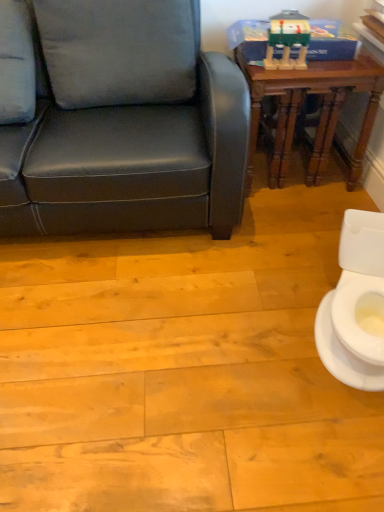
Question: Considering their positions, is white glossy toilet at lower right located in front of or behind wooden table at upper right?

Choices:
 (A) front
 (B) behind

Answer: (A)

Question: From their relative heights in the image, would you say white glossy toilet at lower right is taller or shorter than wooden table at upper right?

Choices:
 (A) tall
 (B) short

Answer: (B)

Question: Which is nearer to the white glossy toilet at lower right?

Choices:
 (A) matte green plastic toy at upper right
 (B) white fabric pillow at upper left
 (C) wooden table at upper right

Answer: (C)

Question: Estimate the real-world distances between objects in this image. Which object is closer to the matte green plastic toy at upper right?

Choices:
 (A) wooden table at upper right
 (B) white glossy toilet at lower right
 (C) white fabric pillow at upper left

Answer: (A)